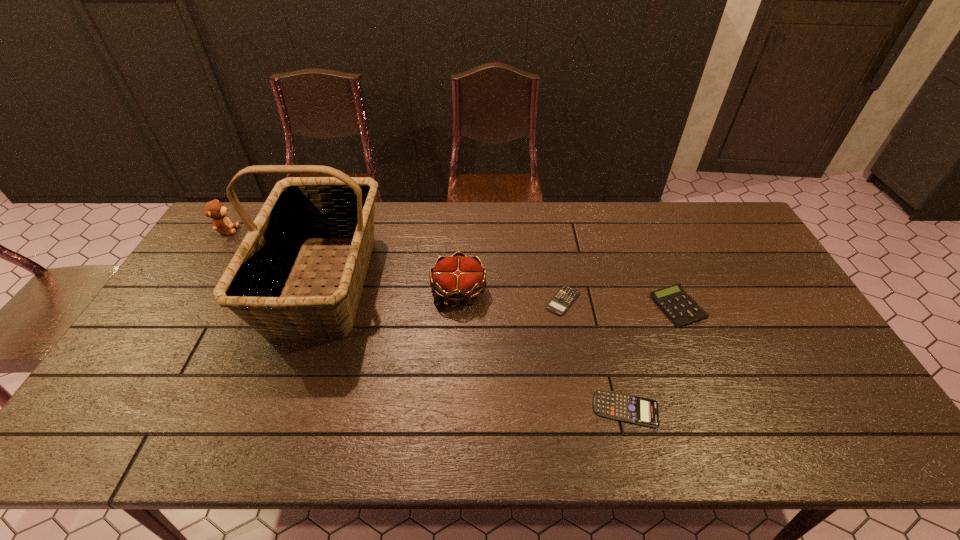
Where is `the shortest object`? This screenshot has height=540, width=960. the shortest object is located at coordinates (565, 296).

At what (x,y) coordinates should I click in order to perform the action: click on blank space located by the handle of the tallest object. Please return your answer as a coordinate pair (x, y). This screenshot has height=540, width=960. Looking at the image, I should click on (291, 381).

This screenshot has width=960, height=540. I want to click on vacant space situated 0.170m on the face of the leftmost object, so click(x=286, y=230).

Image resolution: width=960 pixels, height=540 pixels. I want to click on vacant region located on the right of the fourth shortest object, so click(506, 291).

In order to click on vacant space located on the right of the rightmost calculator in this screenshot , I will do `click(747, 307)`.

Identify the location of free space located on the left of the fifth tallest object. click(490, 409).

Identify the location of vacant region located 0.290m on the front of the shortest calculator. This screenshot has height=540, width=960. (582, 409).

Identify the location of basket at the far edge. (299, 211).

The image size is (960, 540). Find the location of `teddy bear situated at the far edge`. teddy bear situated at the far edge is located at coordinates (214, 209).

Where is `object located at the near edge`? object located at the near edge is located at coordinates 638,410.